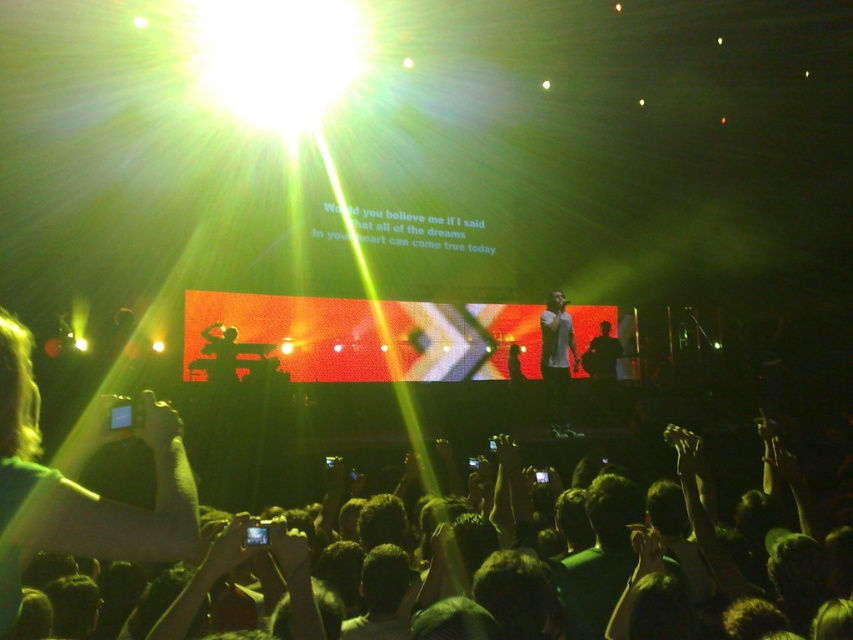
Where is the white matte shirt at center located in the image?

The white matte shirt at center is located at point coordinates of 0.567 on the x axis and 0.654 on the y axis.

You are a photographer at the concert and want to capture a photo of both the white matte shirt at center and the silhouette figure at center. Which one should you focus on first to ensure both are in sharp focus?

You should focus on the white matte shirt at center first because it is closer to the viewer than the silhouette figure at center, ensuring both will be in focus when using depth of field appropriately.

You are a photographer at the concert and want to capture both the white matte shirt at center and the silhouette figure at center in a single shot. Based on their positions, which performer should you focus on first to ensure both are in frame?

Since the white matte shirt at center is to the left of the silhouette figure at center, you should focus on the silhouette figure at center first as it is positioned to the right, allowing you to adjust the camera to include both performers in the frame.